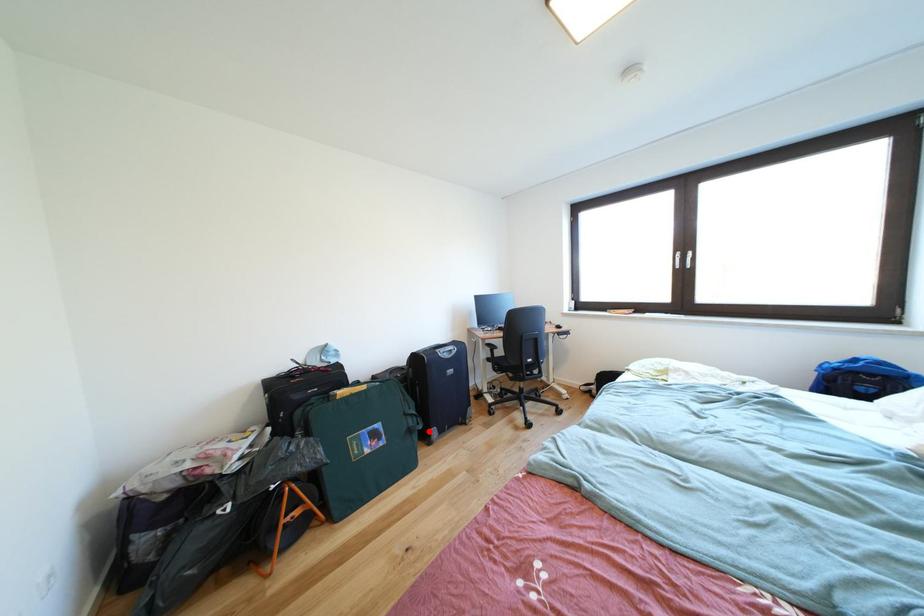
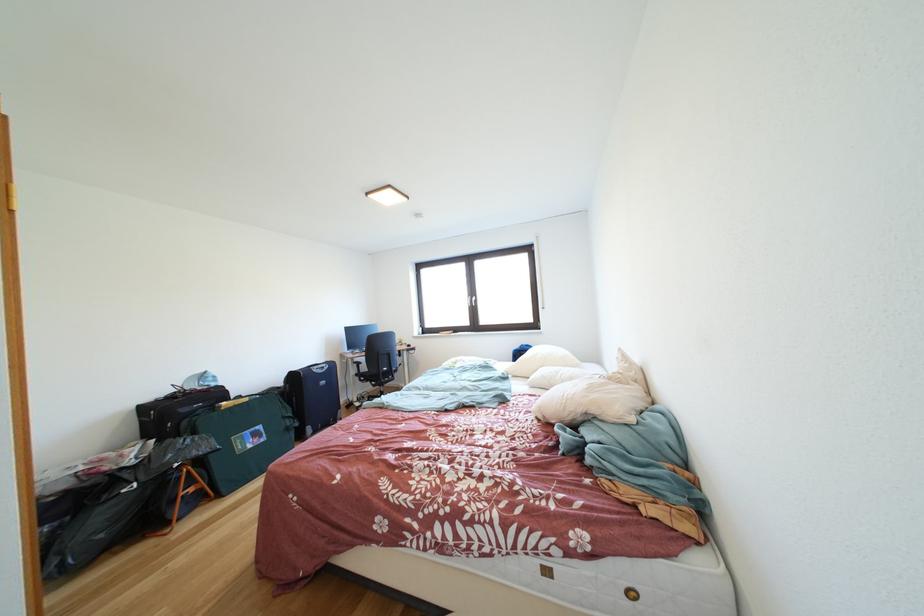
In the second image, find the point that corresponds to the highlighted location in the first image.

(306, 429)